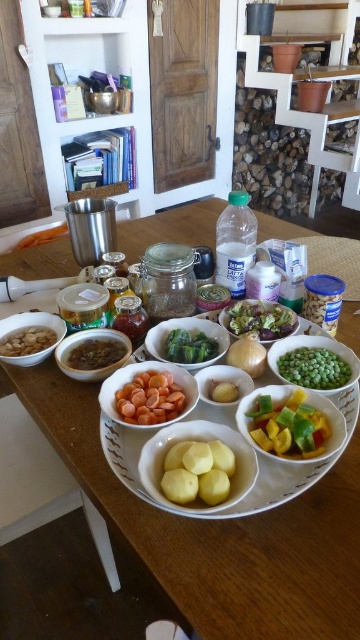
You are arranging ingredients on a kitchen table for a recipe. The recipe requires you to place the sliced yellow and green bell peppers at center next to the white matte onion at center. Based on the current setup, are they positioned correctly?

The sliced yellow and green bell peppers at center are to the right of the white matte onion at center, so they are positioned correctly next to each other.

You have a small spoon that is 10 centimeters long. You need to stir the contents of both the matte white bowl at center and the brown matte nuts at left. Which bowl will require a shorter spoon to stir effectively?

The matte white bowl at center has a smaller width than the brown matte nuts at left, so a shorter spoon would be sufficient for the matte white bowl at center.

You are preparing a salad and need to know which container to use. The yellow matte potatoes at center are too tall for the matte white bowl at center. Which one should you choose?

The yellow matte potatoes at center are much taller than the matte white bowl at center, so they won not fit in it. You should choose a taller container instead.